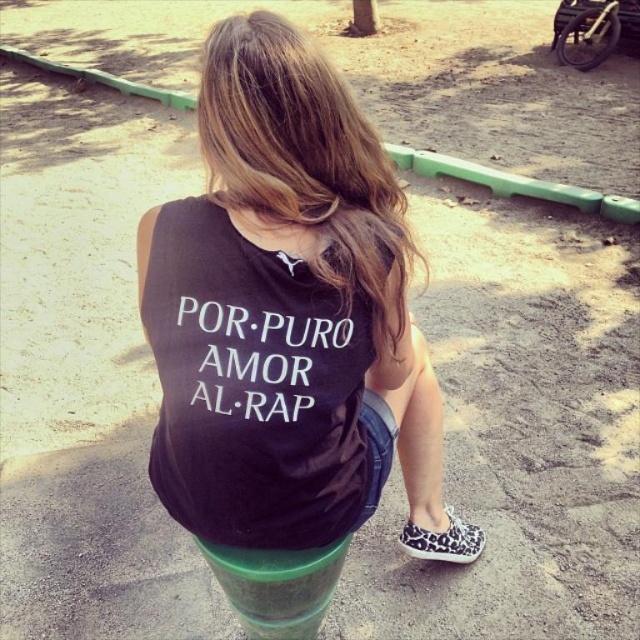
Question: Is black matte tank top at center to the left of black cotton tank top at center from the viewer's perspective?

Choices:
 (A) no
 (B) yes

Answer: (A)

Question: Among these objects, which one is nearest to the camera?

Choices:
 (A) black matte tank top at center
 (B) black cotton tank top at center

Answer: (A)

Question: Does black matte tank top at center appear on the left side of black cotton tank top at center?

Choices:
 (A) no
 (B) yes

Answer: (A)

Question: Which point appears farthest from the camera in this image?

Choices:
 (A) (243, 323)
 (B) (259, 156)

Answer: (A)

Question: Is black matte tank top at center below black cotton tank top at center?

Choices:
 (A) yes
 (B) no

Answer: (A)

Question: Which of the following is the farthest from the observer?

Choices:
 (A) black matte tank top at center
 (B) black cotton tank top at center

Answer: (B)